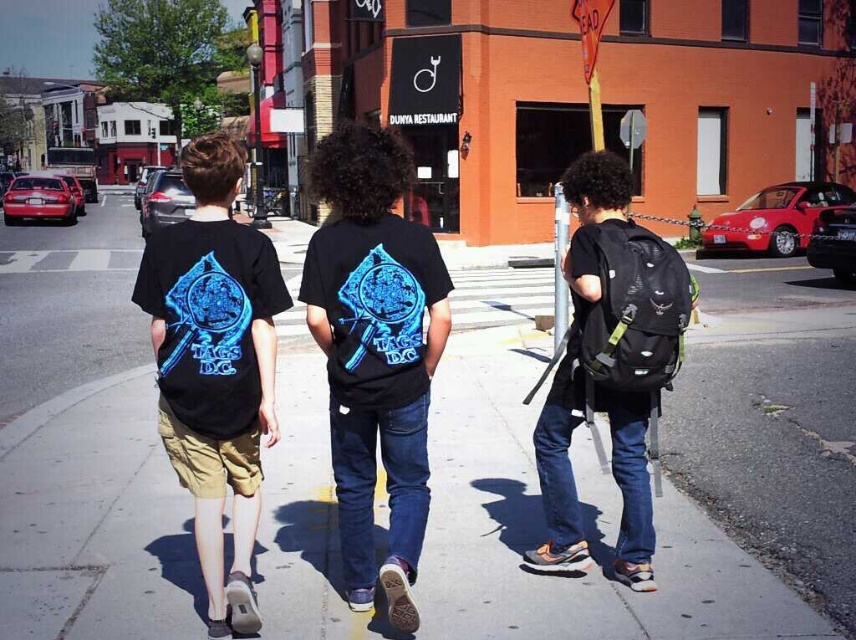
Question: Can you confirm if gray asphalt sidewalk at center is smaller than black matte t-shirt at left?

Choices:
 (A) no
 (B) yes

Answer: (B)

Question: Estimate the real-world distances between objects in this image. Which object is farther from the matte black t-shirt at center?

Choices:
 (A) black matte t-shirt at left
 (B) gray asphalt sidewalk at center

Answer: (B)

Question: Which point is closer to the camera?

Choices:
 (A) matte black t-shirt at center
 (B) gray asphalt sidewalk at center
 (C) black matte t-shirt at left

Answer: (A)

Question: Is gray asphalt sidewalk at center smaller than black matte t-shirt at left?

Choices:
 (A) no
 (B) yes

Answer: (B)

Question: Is gray asphalt sidewalk at center wider than matte black t-shirt at center?

Choices:
 (A) no
 (B) yes

Answer: (B)

Question: Which point is farther from the camera taking this photo?

Choices:
 (A) (441, 452)
 (B) (354, 416)

Answer: (A)